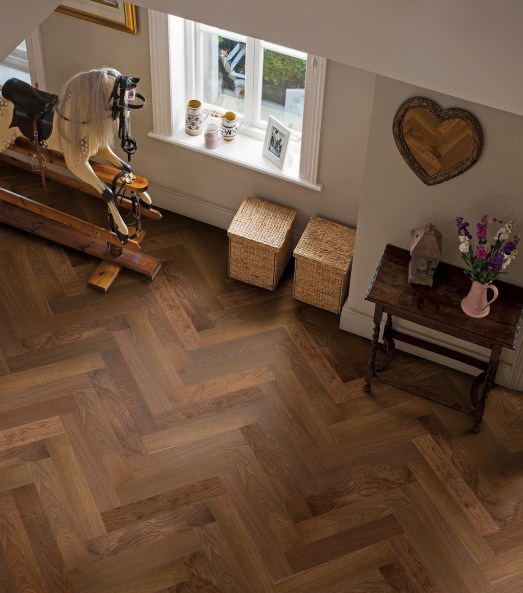
The image size is (523, 593). Identify the location of wicker basket lid. (332, 263).